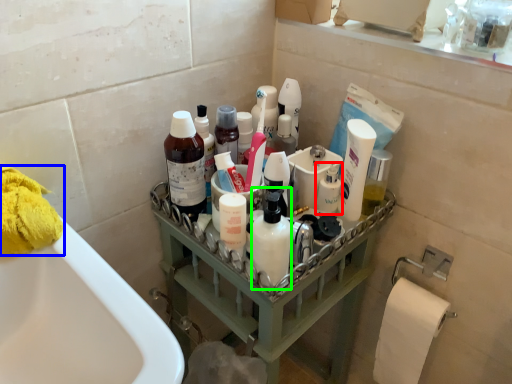
Question: Estimate the real-world distances between objects in this image. Which object is farther from toiletry (highlighted by a red box), toilet paper (highlighted by a blue box) or cleaning product (highlighted by a green box)?

Choices:
 (A) toilet paper
 (B) cleaning product

Answer: (A)